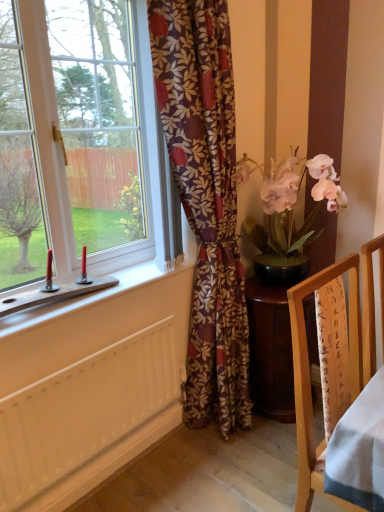
Identify the location of white painted wood radiator at lower left. (88, 420).

Image resolution: width=384 pixels, height=512 pixels. What do you see at coordinates (270, 351) in the screenshot?
I see `wooden desk at center` at bounding box center [270, 351].

Describe the element at coordinates (205, 199) in the screenshot. I see `floral-patterned fabric at center` at that location.

The image size is (384, 512). What do you see at coordinates (325, 365) in the screenshot?
I see `wooden frame at right` at bounding box center [325, 365].

This screenshot has width=384, height=512. I want to click on white painted wood radiator at lower left, so click(88, 420).

Which is behind, floral-patterned fabric at center or white plastic window at left?

Positioned behind is floral-patterned fabric at center.

From a real-world perspective, is floral-patterned fabric at center over white plastic window at left?

No, from a real-world perspective, floral-patterned fabric at center is not on top of white plastic window at left.

Identify the location of window above the floral-patterned fabric at center (from a real-world perspective). Image resolution: width=384 pixels, height=512 pixels. pyautogui.click(x=80, y=147).

What's the angular difference between white plastic window at left and wooden frame at right's facing directions?

They differ by 1.25 degrees in their facing directions.

From the picture: From their relative heights in the image, would you say white plastic window at left is taller or shorter than wooden frame at right?

white plastic window at left is taller than wooden frame at right.

Considering the relative sizes of white plastic window at left and wooden frame at right in the image provided, is white plastic window at left thinner than wooden frame at right?

Yes, white plastic window at left is thinner than wooden frame at right.

Considering the positions of objects white plastic window at left and wooden frame at right in the image provided, who is more to the right, white plastic window at left or wooden frame at right?

wooden frame at right.

In terms of size, does floral-patterned fabric at center appear bigger or smaller than wooden desk at center?

In the image, floral-patterned fabric at center appears to be larger than wooden desk at center.

From the image's perspective, does floral-patterned fabric at center appear higher than wooden desk at center?

Yes, from the image's perspective, floral-patterned fabric at center is above wooden desk at center.

Image resolution: width=384 pixels, height=512 pixels. Find the location of `desk that appears below the floral-patterned fabric at center (from a real-world perspective)`. desk that appears below the floral-patterned fabric at center (from a real-world perspective) is located at coordinates (270, 351).

Looking at this image, which is correct: floral-patterned fabric at center is inside wooden desk at center, or outside of it?

floral-patterned fabric at center is located beyond the bounds of wooden desk at center.

How different are the orientations of floral-patterned fabric at center and wooden frame at right in degrees?

1.14 degrees separate the facing orientations of floral-patterned fabric at center and wooden frame at right.

Which object is further away from the camera taking this photo, floral-patterned fabric at center or wooden frame at right?

Positioned behind is floral-patterned fabric at center.

From the picture: Between floral-patterned fabric at center and wooden frame at right, which one has more height?

floral-patterned fabric at center.

Is wooden frame at right at the back of floral-patterned fabric at center?

No, floral-patterned fabric at center's orientation is not away from wooden frame at right.

Does white plastic window at left have a greater width compared to wooden desk at center?

In fact, white plastic window at left might be narrower than wooden desk at center.

Do you think white plastic window at left is within wooden desk at center, or outside of it?

white plastic window at left is not inside wooden desk at center, it's outside.

Which point is more distant from viewer, (147, 36) or (256, 404)?

Point (256, 404)

Looking at this image, is white plastic window at left facing away from wooden desk at center?

No, white plastic window at left is not facing the opposite direction of wooden desk at center.

Which object is more forward, wooden frame at right or white plastic window at left?

wooden frame at right is more forward.

Is wooden frame at right facing away from white plastic window at left?

Yes, wooden frame at right is positioned with its back facing white plastic window at left.

From the image's perspective, is wooden frame at right located above or below white plastic window at left?

From the image's perspective, wooden frame at right appears below white plastic window at left.

From a real-world perspective, is wooden desk at center above or below wooden frame at right?

wooden desk at center is situated lower than wooden frame at right in the real world.

Based on the photo, in the image, is wooden desk at center positioned in front of or behind wooden frame at right?

In the image, wooden desk at center appears behind wooden frame at right.

Where is `curtain on the right of the white plastic window at left`? curtain on the right of the white plastic window at left is located at coordinates (205, 199).

Locate an element on the screen. window located on the left of wooden frame at right is located at coordinates (80, 147).

Looking at the image, which one is located further to wooden desk at center, white plastic window at left or floral-patterned fabric at center?

white plastic window at left lies further to wooden desk at center than the other object.

Which object lies nearer to the anchor point wooden frame at right, floral-patterned fabric at center or pink silk orchid at right?

floral-patterned fabric at center is positioned closer to the anchor wooden frame at right.

Which object lies further to the anchor point floral-patterned fabric at center, wooden frame at right or white plastic window at left?

Among the two, wooden frame at right is located further to floral-patterned fabric at center.

From the image, which object appears to be nearer to white plastic window at left, wooden frame at right or floral-patterned fabric at center?

floral-patterned fabric at center.

Looking at the image, which one is located closer to white painted wood radiator at lower left, white plastic window at left or floral-patterned fabric at center?

floral-patterned fabric at center lies closer to white painted wood radiator at lower left than the other object.

From the image, which object appears to be nearer to wooden frame at right, pink silk orchid at right or wooden desk at center?

wooden desk at center is closer to wooden frame at right.

Estimate the real-world distances between objects in this image. Which object is further from wooden desk at center, floral-patterned fabric at center or wooden frame at right?

Based on the image, wooden frame at right appears to be further to wooden desk at center.

Which object lies further to the anchor point wooden desk at center, white plastic window at left or pink silk orchid at right?

white plastic window at left is further to wooden desk at center.

The image size is (384, 512). What are the coordinates of `houseplant between white plastic window at left and white painted wood radiator at lower left from top to bottom` in the screenshot? It's located at (290, 202).

I want to click on curtain between wooden frame at right and wooden desk at center along the z-axis, so click(205, 199).

Where is `curtain located between white plastic window at left and wooden desk at center in the left-right direction`? curtain located between white plastic window at left and wooden desk at center in the left-right direction is located at coordinates [x=205, y=199].

Locate an element on the screen. This screenshot has height=512, width=384. desk between white plastic window at left and wooden frame at right in the horizontal direction is located at coordinates (270, 351).